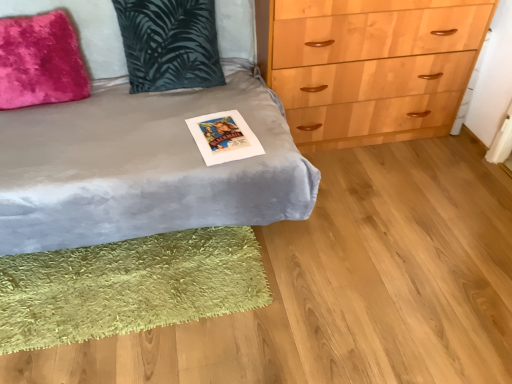
What is the approximate width of velvety dark green pillow at upper left, the second pillow in the left-to-right sequence?

11.31 inches.

Locate an element on the screen. matte paper postcard at center is located at coordinates (224, 137).

Measure the distance between point (63,120) and camera.

Point (63,120) is 1.66 meters from camera.

Locate an element on the screen. velvet gray bed at center is located at coordinates (143, 166).

What are the coordinates of `velvety dark green pillow at upper left, the first pillow when ordered from right to left` in the screenshot? It's located at (169, 44).

From the image's perspective, between matte paper postcard at center and green shaggy rug at lower left, which one is located above?

matte paper postcard at center is shown above in the image.

From a real-world perspective, is matte paper postcard at center over green shaggy rug at lower left?

Correct, in the physical world, matte paper postcard at center is higher than green shaggy rug at lower left.

Based on the photo, can you tell me how much matte paper postcard at center and green shaggy rug at lower left differ in facing direction?

10.3 degrees.

Is matte paper postcard at center shorter than green shaggy rug at lower left?

Indeed, matte paper postcard at center has a lesser height compared to green shaggy rug at lower left.

Is green shaggy rug at lower left thinner than velvet gray bed at center?

Yes, green shaggy rug at lower left is thinner than velvet gray bed at center.

Where is `bed that is in front of the green shaggy rug at lower left`? The image size is (512, 384). bed that is in front of the green shaggy rug at lower left is located at coordinates coord(143,166).

Based on the photo, is velvet gray bed at center completely or partially inside green shaggy rug at lower left?

No, velvet gray bed at center is not inside green shaggy rug at lower left.

Is there a large distance between green shaggy rug at lower left and velvet gray bed at center?

No.

Is the depth of velvet gray bed at center less than that of velvety dark green pillow at upper left, the first pillow when ordered from right to left?

Yes, the depth of velvet gray bed at center is less than that of velvety dark green pillow at upper left, the first pillow when ordered from right to left.

Is point (181, 160) positioned behind point (188, 29)?

No, it is not.

Considering the relative positions of velvet gray bed at center and velvety dark green pillow at upper left, the first pillow when ordered from right to left, in the image provided, is velvet gray bed at center to the left or to the right of velvety dark green pillow at upper left, the first pillow when ordered from right to left,?

velvet gray bed at center is positioned on velvety dark green pillow at upper left, the first pillow when ordered from right to left,'s left side.

In the scene shown: Can you tell me how much green shaggy rug at lower left and matte paper postcard at center differ in facing direction?

10.3 degrees separate the facing orientations of green shaggy rug at lower left and matte paper postcard at center.

What are the coordinates of `mat on the left of matte paper postcard at center` in the screenshot? It's located at (128, 286).

Are green shaggy rug at lower left and matte paper postcard at center located far from each other?

green shaggy rug at lower left is actually quite close to matte paper postcard at center.

Would you say green shaggy rug at lower left is inside or outside matte paper postcard at center?

green shaggy rug at lower left is not inside matte paper postcard at center, it's outside.

Is green shaggy rug at lower left located outside fuzzy pink pillow at upper left, which is the second pillow from right to left?

Yes, green shaggy rug at lower left is not within fuzzy pink pillow at upper left, which is the second pillow from right to left.

Which object is further away from the camera, green shaggy rug at lower left or fuzzy pink pillow at upper left, the 1th pillow positioned from the left?

fuzzy pink pillow at upper left, the 1th pillow positioned from the left, is further from the camera.

Find the location of a particular element. This screenshot has height=384, width=512. pillow that is the 1st object located above the green shaggy rug at lower left (from the image's perspective) is located at coordinates (40, 61).

Considering the sizes of objects green shaggy rug at lower left and fuzzy pink pillow at upper left, which is the second pillow from right to left, in the image provided, who is shorter, green shaggy rug at lower left or fuzzy pink pillow at upper left, which is the second pillow from right to left,?

green shaggy rug at lower left.

Considering the relative sizes of fuzzy pink pillow at upper left, which is the second pillow from right to left, and matte paper postcard at center in the image provided, is fuzzy pink pillow at upper left, which is the second pillow from right to left, bigger than matte paper postcard at center?

Indeed, fuzzy pink pillow at upper left, which is the second pillow from right to left, has a larger size compared to matte paper postcard at center.

How far apart are fuzzy pink pillow at upper left, the 1th pillow positioned from the left, and matte paper postcard at center?

fuzzy pink pillow at upper left, the 1th pillow positioned from the left, and matte paper postcard at center are 26.70 inches apart from each other.

This screenshot has width=512, height=384. I want to click on postcard below the fuzzy pink pillow at upper left, the 1th pillow positioned from the left (from the image's perspective), so click(224, 137).

Which is in front, fuzzy pink pillow at upper left, the 1th pillow positioned from the left, or matte paper postcard at center?

matte paper postcard at center is in front.

How far apart are matte paper postcard at center and fuzzy pink pillow at upper left, which is the second pillow from right to left?

26.70 inches.

Is the position of matte paper postcard at center more distant than that of fuzzy pink pillow at upper left, the 1th pillow positioned from the left?

No, matte paper postcard at center is closer to the camera.

Between matte paper postcard at center and fuzzy pink pillow at upper left, the 1th pillow positioned from the left, which one appears on the left side from the viewer's perspective?

From the viewer's perspective, fuzzy pink pillow at upper left, the 1th pillow positioned from the left, appears more on the left side.

From a real-world perspective, which object rests below the other?

matte paper postcard at center, from a real-world perspective.

Locate an element on the screen. postcard that is behind the green shaggy rug at lower left is located at coordinates (224, 137).

This screenshot has width=512, height=384. I want to click on bed on the left of green shaggy rug at lower left, so click(143, 166).

When comparing their distances from velvet gray bed at center, does matte paper postcard at center or green shaggy rug at lower left seem further?

The object further to velvet gray bed at center is green shaggy rug at lower left.

Which object lies further to the anchor point velvet gray bed at center, green shaggy rug at lower left or matte paper postcard at center?

The object further to velvet gray bed at center is green shaggy rug at lower left.

Based on their spatial positions, is velvety dark green pillow at upper left, the second pillow in the left-to-right sequence, or fuzzy pink pillow at upper left, which is the second pillow from right to left, further from velvet gray bed at center?

fuzzy pink pillow at upper left, which is the second pillow from right to left.

Looking at the image, which one is located further to fuzzy pink pillow at upper left, the 1th pillow positioned from the left, velvety dark green pillow at upper left, the second pillow in the left-to-right sequence, or matte paper postcard at center?

The object further to fuzzy pink pillow at upper left, the 1th pillow positioned from the left, is matte paper postcard at center.

Estimate the real-world distances between objects in this image. Which object is closer to velvety dark green pillow at upper left, the first pillow when ordered from right to left, matte paper postcard at center or green shaggy rug at lower left?

Based on the image, matte paper postcard at center appears to be nearer to velvety dark green pillow at upper left, the first pillow when ordered from right to left.

Consider the image. Estimate the real-world distances between objects in this image. Which object is closer to matte paper postcard at center, green shaggy rug at lower left or velvety dark green pillow at upper left, the second pillow in the left-to-right sequence?

Based on the image, velvety dark green pillow at upper left, the second pillow in the left-to-right sequence, appears to be nearer to matte paper postcard at center.

Based on their spatial positions, is velvet gray bed at center or matte paper postcard at center closer to green shaggy rug at lower left?

velvet gray bed at center.

When comparing their distances from matte paper postcard at center, does fuzzy pink pillow at upper left, which is the second pillow from right to left, or velvet gray bed at center seem closer?

velvet gray bed at center.

This screenshot has height=384, width=512. What are the coordinates of `bed that lies between velvety dark green pillow at upper left, the second pillow in the left-to-right sequence, and green shaggy rug at lower left from top to bottom` in the screenshot? It's located at (143, 166).

The width and height of the screenshot is (512, 384). Identify the location of pillow between velvet gray bed at center and velvety dark green pillow at upper left, the second pillow in the left-to-right sequence, in the front-back direction. (40, 61).

The height and width of the screenshot is (384, 512). I want to click on postcard between velvet gray bed at center and green shaggy rug at lower left in the vertical direction, so click(224, 137).

At what (x,y) coordinates should I click in order to perform the action: click on bed that lies between fuzzy pink pillow at upper left, which is the second pillow from right to left, and green shaggy rug at lower left from top to bottom. Please return your answer as a coordinate pair (x, y). Image resolution: width=512 pixels, height=384 pixels. Looking at the image, I should click on (143, 166).